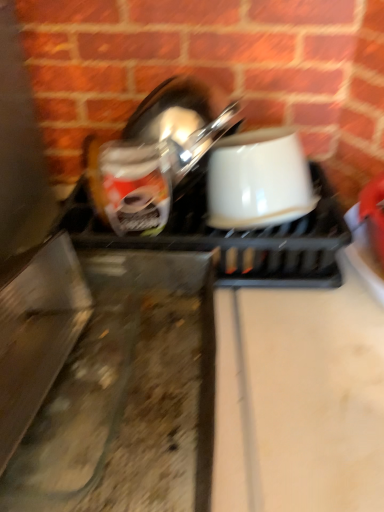
Image resolution: width=384 pixels, height=512 pixels. Describe the element at coordinates (218, 230) in the screenshot. I see `white glossy bowl at center` at that location.

In order to face white glossy bowl at center, should I rotate leftwards or rightwards?

A 2.788 degree turn to the right will do.

The image size is (384, 512). In order to click on white glossy bowl at center in this screenshot , I will do `click(218, 230)`.

This screenshot has width=384, height=512. What do you see at coordinates (258, 180) in the screenshot?
I see `white glossy coffee cup at center` at bounding box center [258, 180].

Where is `white glossy coffee cup at center`? The height and width of the screenshot is (512, 384). white glossy coffee cup at center is located at coordinates [258, 180].

Where is `white glossy bowl at center`? white glossy bowl at center is located at coordinates (218, 230).

Consider the image. Can you confirm if white glossy coffee cup at center is positioned to the left of white glossy bowl at center?

Incorrect, white glossy coffee cup at center is not on the left side of white glossy bowl at center.

Considering their positions, is white glossy coffee cup at center located in front of or behind white glossy bowl at center?

In the image, white glossy coffee cup at center appears in front of white glossy bowl at center.

Considering the points (246, 177) and (331, 202), which point is behind, point (246, 177) or point (331, 202)?

Point (331, 202)

From the image's perspective, would you say white glossy coffee cup at center is shown under white glossy bowl at center?

No, from the image's perspective, white glossy coffee cup at center is not beneath white glossy bowl at center.

From a real-world perspective, is white glossy coffee cup at center over white glossy bowl at center?

Yes, from a real-world perspective, white glossy coffee cup at center is on top of white glossy bowl at center.

In the scene shown: Between white glossy coffee cup at center and white glossy bowl at center, which one has larger width?

Wider between the two is white glossy bowl at center.

Does white glossy coffee cup at center have a greater height compared to white glossy bowl at center?

Yes, white glossy coffee cup at center is taller than white glossy bowl at center.

Does white glossy coffee cup at center have a smaller size compared to white glossy bowl at center?

Indeed, white glossy coffee cup at center has a smaller size compared to white glossy bowl at center.

Would you say white glossy coffee cup at center is inside or outside white glossy bowl at center?

white glossy coffee cup at center is inside white glossy bowl at center.

Are white glossy coffee cup at center and white glossy bowl at center beside each other?

Yes, white glossy coffee cup at center is beside white glossy bowl at center.

Is white glossy coffee cup at center looking in the opposite direction of white glossy bowl at center?

white glossy coffee cup at center is not turned away from white glossy bowl at center.

Can you tell me how much white glossy coffee cup at center and white glossy bowl at center differ in facing direction?

1.97 degrees.

The width and height of the screenshot is (384, 512). Find the location of `coffee cup on the right of white glossy bowl at center`. coffee cup on the right of white glossy bowl at center is located at coordinates pos(258,180).

Which is more to the right, white glossy bowl at center or white glossy coffee cup at center?

From the viewer's perspective, white glossy coffee cup at center appears more on the right side.

Looking at this image, relative to white glossy coffee cup at center, is white glossy bowl at center in front or behind?

white glossy bowl at center is behind white glossy coffee cup at center.

Considering the positions of point (230, 133) and point (277, 128), is point (230, 133) closer or farther from the camera than point (277, 128)?

Point (230, 133) is positioned farther from the camera compared to point (277, 128).

From the image's perspective, is white glossy bowl at center on white glossy coffee cup at center?

Incorrect, from the image's perspective, white glossy bowl at center is lower than white glossy coffee cup at center.

From a real-world perspective, between white glossy bowl at center and white glossy coffee cup at center, who is vertically lower?

From a 3D spatial view, white glossy bowl at center is below.

Which object is thinner, white glossy bowl at center or white glossy coffee cup at center?

Thinner between the two is white glossy coffee cup at center.

Does white glossy bowl at center have a lesser height compared to white glossy coffee cup at center?

Correct, white glossy bowl at center is not as tall as white glossy coffee cup at center.

Between white glossy bowl at center and white glossy coffee cup at center, which one has larger size?

With larger size is white glossy bowl at center.

Could white glossy coffee cup at center be considered to be inside white glossy bowl at center?

Yes, white glossy coffee cup at center is inside white glossy bowl at center.

Are white glossy bowl at center and white glossy coffee cup at center far apart?

They are positioned close to each other.

Is white glossy bowl at center looking in the opposite direction of white glossy coffee cup at center?

That's right, white glossy bowl at center is facing away from white glossy coffee cup at center.

The height and width of the screenshot is (512, 384). Identify the location of coffee cup above the white glossy bowl at center (from the image's perspective). (258, 180).

This screenshot has width=384, height=512. I want to click on coffee cup on the right of the white glossy bowl at center, so click(x=258, y=180).

In order to click on coffee cup above the white glossy bowl at center (from the image's perspective) in this screenshot , I will do `click(258, 180)`.